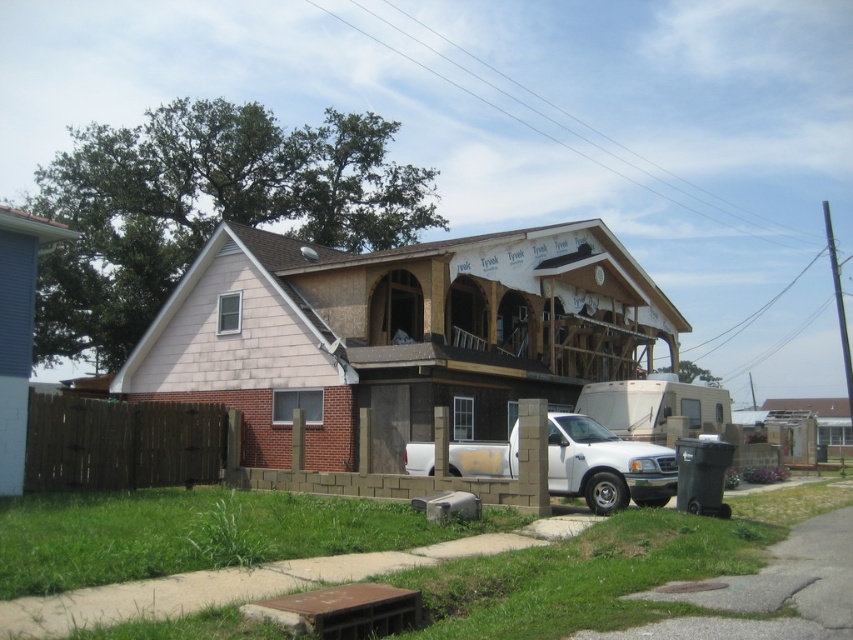
Question: Does wooden frame house at center appear over white matte truck at center?

Choices:
 (A) no
 (B) yes

Answer: (B)

Question: Can you confirm if wooden frame house at center is thinner than white matte truck at center?

Choices:
 (A) yes
 (B) no

Answer: (B)

Question: Among these objects, which one is farthest from the camera?

Choices:
 (A) wooden frame house at center
 (B) white matte truck at center

Answer: (A)

Question: Does wooden frame house at center have a lesser width compared to white matte truck at center?

Choices:
 (A) no
 (B) yes

Answer: (A)